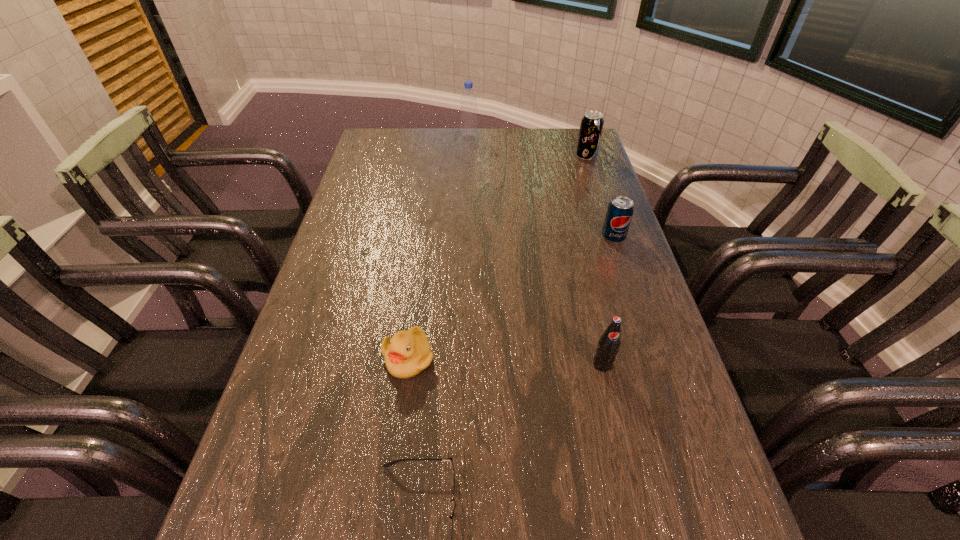
Identify the location of free location that satisfies the following two spatial constraints: 1. on the front side of the farthest object; 2. on the left side of the farthest soda can. Image resolution: width=960 pixels, height=540 pixels. (468, 157).